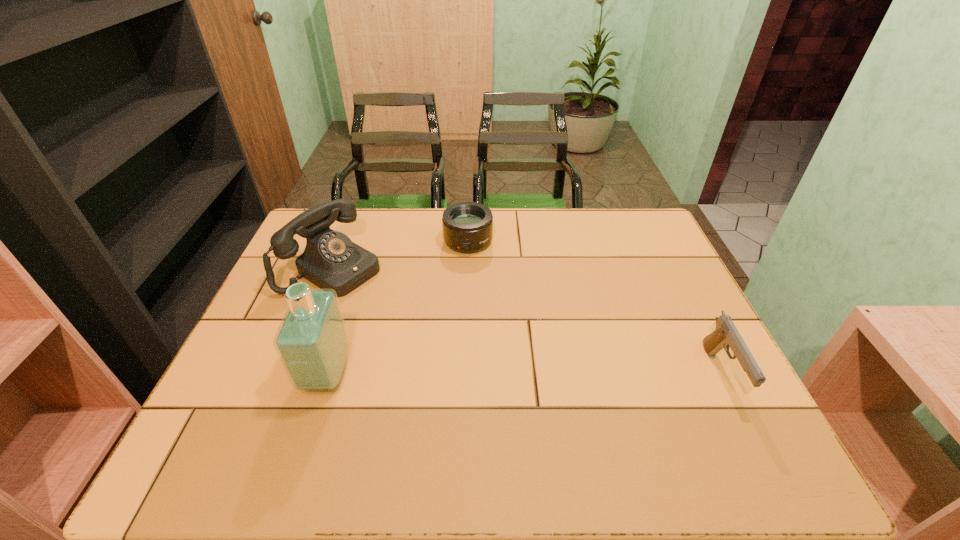
Find the location of a particular element. the tallest object is located at coordinates (312, 344).

At what (x,y) coordinates should I click in order to perform the action: click on the third tallest object. Please return your answer as a coordinate pair (x, y). Looking at the image, I should click on (726, 335).

This screenshot has height=540, width=960. What are the coordinates of `pistol` in the screenshot? It's located at (726, 335).

Identify the location of the shortest object. (467, 226).

Find the location of a particular element. The width and height of the screenshot is (960, 540). the second object from right to left is located at coordinates (467, 226).

Identify the location of the third shortest object. The height and width of the screenshot is (540, 960). (331, 260).

At what (x,y) coordinates should I click in order to perform the action: click on free space located on the front label of the tallest object. Please return your answer as a coordinate pair (x, y). The height and width of the screenshot is (540, 960). Looking at the image, I should click on (276, 375).

This screenshot has height=540, width=960. I want to click on free location located on the front label of the tallest object, so click(x=253, y=375).

Locate an element on the screen. vacant area located 0.090m on the front label of the tallest object is located at coordinates (267, 375).

In order to click on vacant area located on the side of the third object from left to right with brand markings and control switches in this screenshot , I will do `click(480, 326)`.